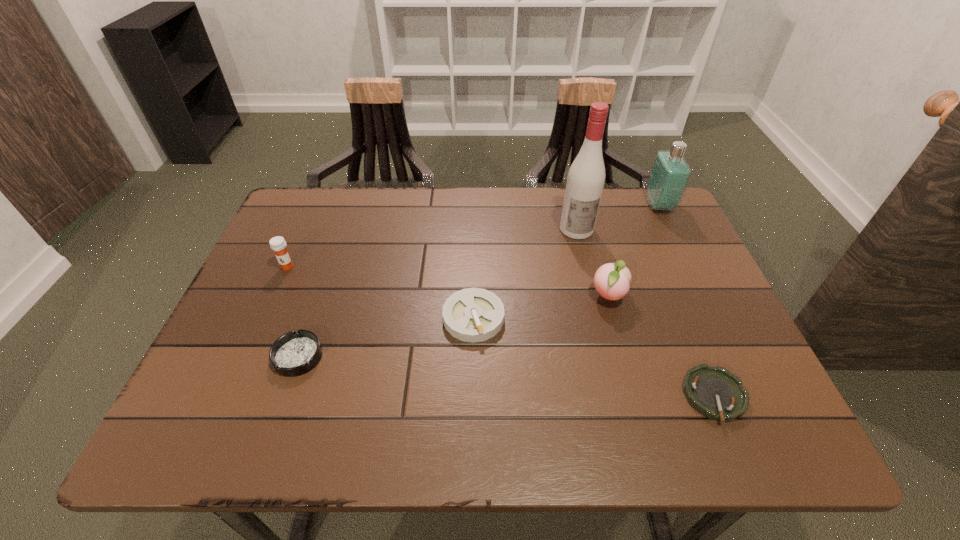
Identify the location of the tallest object. (585, 181).

At what (x,y) coordinates should I click in order to perform the action: click on alcohol. Please return your answer as a coordinate pair (x, y). The width and height of the screenshot is (960, 540). Looking at the image, I should click on (585, 181).

At what (x,y) coordinates should I click in order to perform the action: click on the farthest object. Please return your answer as a coordinate pair (x, y). Looking at the image, I should click on (670, 174).

Locate an element on the screen. The width and height of the screenshot is (960, 540). the second tallest object is located at coordinates (670, 174).

Locate an element on the screen. peach is located at coordinates (611, 280).

Where is `the leftmost object`? the leftmost object is located at coordinates (278, 244).

This screenshot has height=540, width=960. I want to click on medicine, so click(x=278, y=244).

This screenshot has height=540, width=960. I want to click on the tallest ashtray, so click(473, 315).

Where is `the fifth tallest object`? Image resolution: width=960 pixels, height=540 pixels. the fifth tallest object is located at coordinates (473, 315).

Image resolution: width=960 pixels, height=540 pixels. I want to click on the sixth tallest object, so click(295, 353).